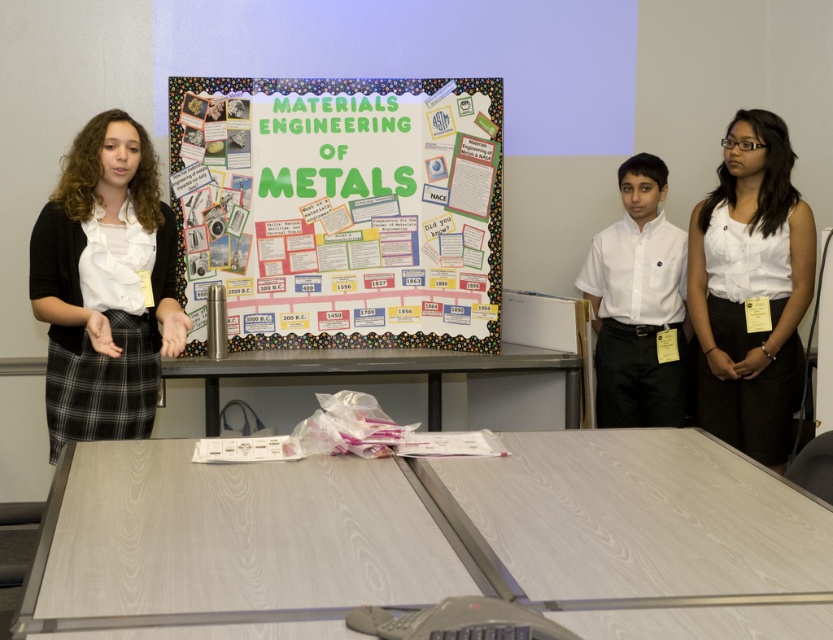
What is the color of the clothing item located at coordinate point (751, 289)?

The point at (751, 289) indicates the white satin blouse at center.

You are an attendee at the presentation and want to take a photo of the multicolored paperboard at center without the matte black skirt at left blocking the view. Is the paperboard positioned in a way that allows this?

The multicolored paperboard at center is further to the viewer than the matte black skirt at left, so it is positioned behind the skirt. Therefore, the matte black skirt at left would block the view of the multicolored paperboard at center when taking a photo.

You are an attendee at a conference and see two white tops at center in the image of the presentation. Which one is closer to you, the white satin blouse at center or the white smooth shirt at center?

The white satin blouse at center is closer to the viewer than the white smooth shirt at center.